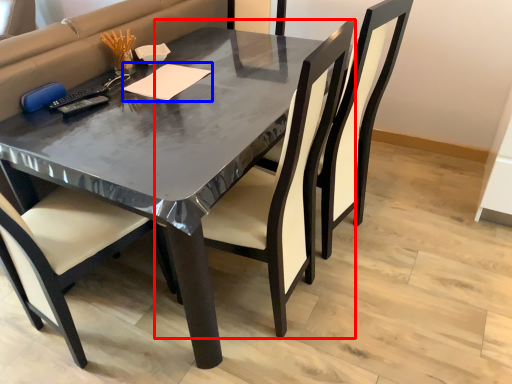
Question: Which object appears closest to the camera in this image, chair (highlighted by a red box) or notepad (highlighted by a blue box)?

Choices:
 (A) chair
 (B) notepad

Answer: (A)